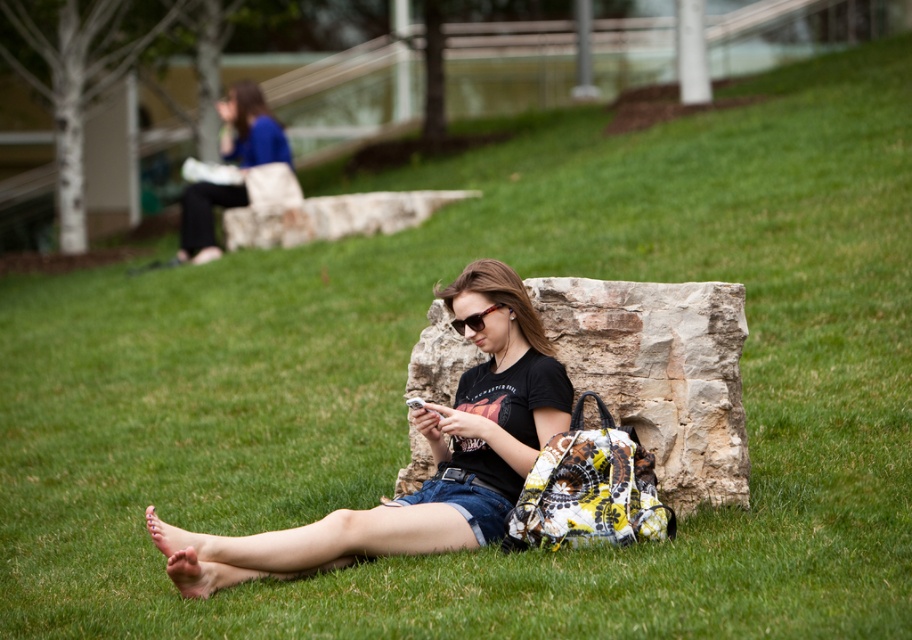
Question: Can you confirm if black matte t-shirt at center is positioned to the right of blue fabric bag at upper left?

Choices:
 (A) no
 (B) yes

Answer: (B)

Question: Among these points, which one is nearest to the camera?

Choices:
 (A) (499, 305)
 (B) (324, 548)
 (C) (192, 256)

Answer: (B)

Question: In this image, where is black matte t-shirt at center located relative to translucent orange sunglasses at center?

Choices:
 (A) below
 (B) above

Answer: (A)

Question: Among these points, which one is nearest to the camera?

Choices:
 (A) (193, 257)
 (B) (506, 333)
 (C) (482, 314)

Answer: (C)

Question: Which point is closer to the camera taking this photo?

Choices:
 (A) (286, 552)
 (B) (467, 316)
 (C) (188, 218)

Answer: (A)

Question: Is black matte t-shirt at center smaller than blue fabric bag at upper left?

Choices:
 (A) no
 (B) yes

Answer: (A)